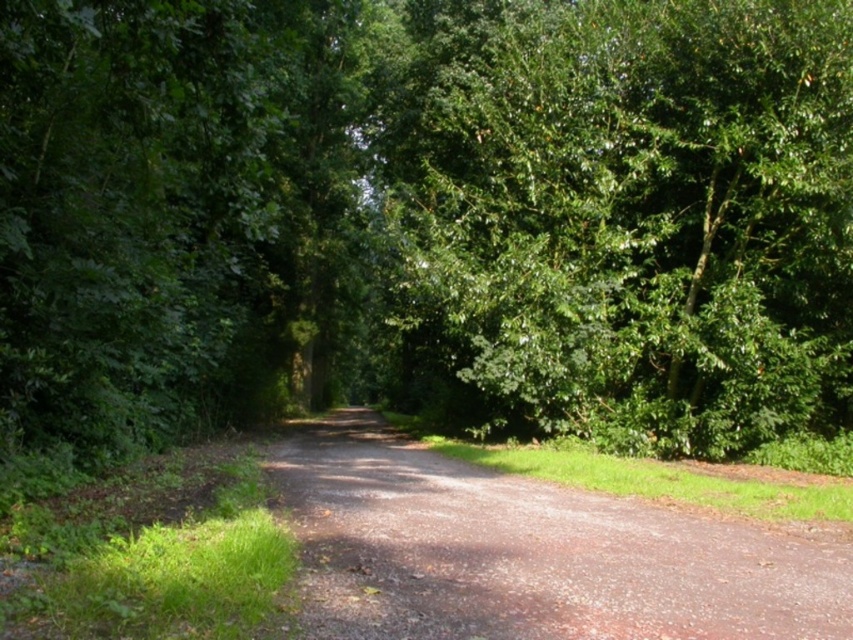
Which of these two, green leafy tree at center or dirt/gravel path at center, stands shorter?

With less height is dirt/gravel path at center.

Where is `green leafy tree at center`? green leafy tree at center is located at coordinates (636, 227).